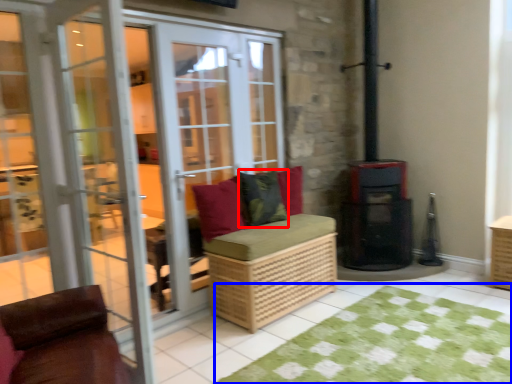
Question: Which object appears closest to the camera in this image, pillow (highlighted by a red box) or doormat (highlighted by a blue box)?

Choices:
 (A) pillow
 (B) doormat

Answer: (B)